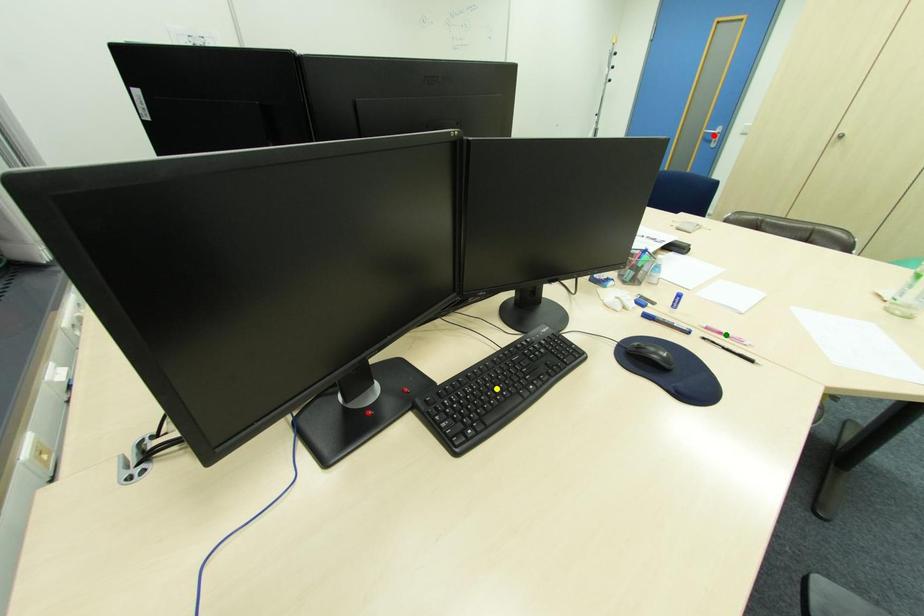
Order these from nearest to farthest:
1. red point
2. green point
3. yellow point

yellow point → green point → red point